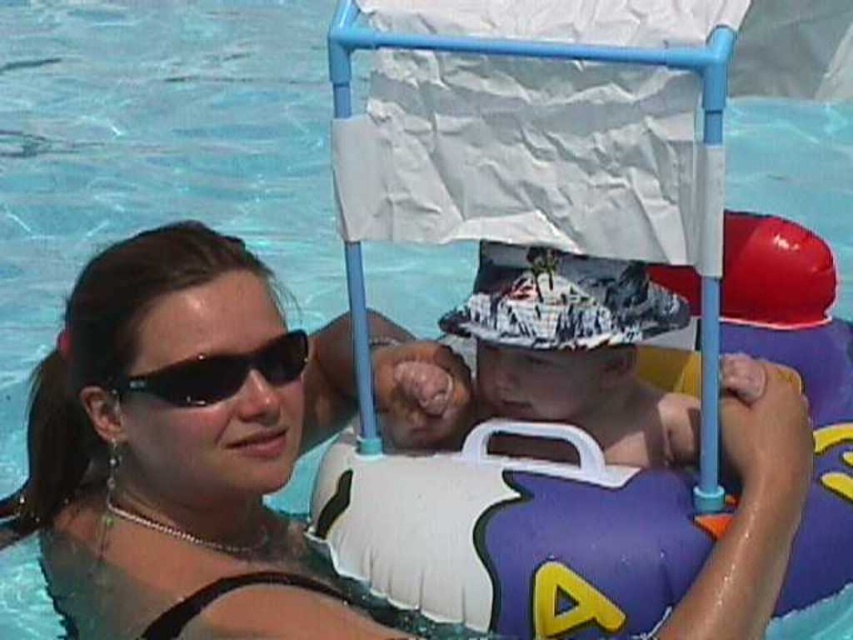
Question: Can you confirm if white cotton hat at center is smaller than black plastic sunglasses at upper center?

Choices:
 (A) no
 (B) yes

Answer: (A)

Question: In this image, where is white cotton hat at center located relative to black plastic sunglasses at upper center?

Choices:
 (A) left
 (B) right

Answer: (B)

Question: Which of the following is the farthest from the observer?

Choices:
 (A) (525, 410)
 (B) (247, 369)
 (C) (42, 371)

Answer: (C)

Question: Can you confirm if sunglasses at upper left is smaller than black plastic sunglasses at upper center?

Choices:
 (A) yes
 (B) no

Answer: (B)

Question: Among these points, which one is nearest to the camera?

Choices:
 (A) (306, 355)
 (B) (164, 314)
 (C) (659, 291)

Answer: (B)

Question: Which point is farther from the camera taking this photo?

Choices:
 (A) (154, 376)
 (B) (440, 422)
 (C) (618, 312)

Answer: (B)